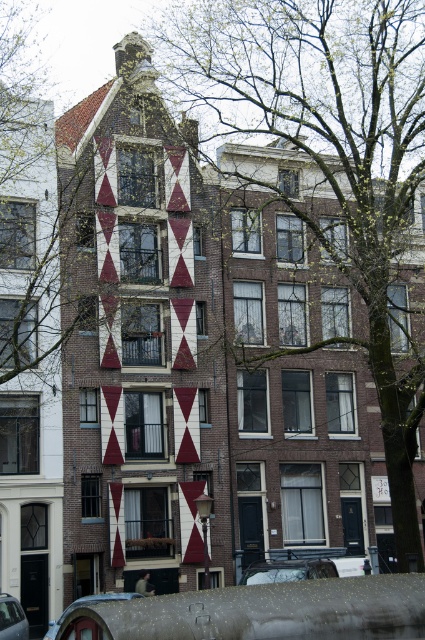
You are a delivery driver trying to park your metallic silver car at lower center next to the metallic silver car at lower left. Based on their widths, can you safely park your car without touching the other car?

The metallic silver car at lower center might be wider than metallic silver car at lower left, so there is uncertainty about whether it can be parked safely without touching the other car.

You are standing at the entrance of the residential building and want to park your metallic silver car at lower center. The parking spot is located at coordinate point 0.892, 0.680. Can you confirm if the car is already parked in the correct spot?

Yes, the metallic silver car at lower center is already parked at the correct coordinate point (289, 570).